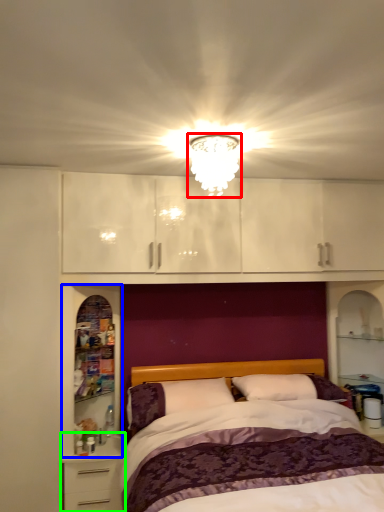
Question: Based on their relative distances, which object is farther from light fixture (highlighted by a red box)? Choose from cabinet (highlighted by a blue box) and nightstand (highlighted by a green box).

Choices:
 (A) cabinet
 (B) nightstand

Answer: (B)